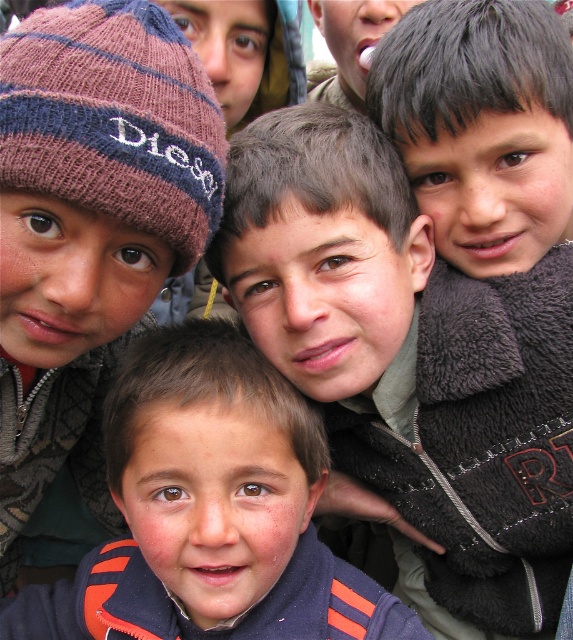
In the scene shown: Can you confirm if matte gray jacket at center is positioned below dark blue fleece jacket at center?

No.

Does point (567, 364) lie behind point (245, 611)?

Yes, point (567, 364) is farther from viewer.

Where is `matte gray jacket at center`? The height and width of the screenshot is (640, 573). matte gray jacket at center is located at coordinates (410, 368).

Identify the location of matte gray jacket at center. (410, 368).

Who is taller, dark blue fleece jacket at center or knitted woolen beanie at upper left?

Standing taller between the two is dark blue fleece jacket at center.

Does dark blue fleece jacket at center come in front of knitted woolen beanie at upper left?

No, it is not.

Does point (160, 538) come farther from viewer compared to point (34, 148)?

Yes, it is.

I want to click on dark blue fleece jacket at center, so click(210, 509).

Who is positioned more to the left, matte gray jacket at center or knitted woolen beanie at upper left?

knitted woolen beanie at upper left

Consider the image. Can you confirm if matte gray jacket at center is smaller than knitted woolen beanie at upper left?

Actually, matte gray jacket at center might be larger than knitted woolen beanie at upper left.

Does point (559, 317) come behind point (77, 1)?

Yes, point (559, 317) is behind point (77, 1).

You are a GUI agent. You are given a task and a screenshot of the screen. Output one action in this format:
    pyautogui.click(x=<x>, y=<y>)
    Task: Click on the matte gray jacket at center
    This screenshot has width=573, height=640.
    Given the screenshot: What is the action you would take?
    pyautogui.click(x=410, y=368)